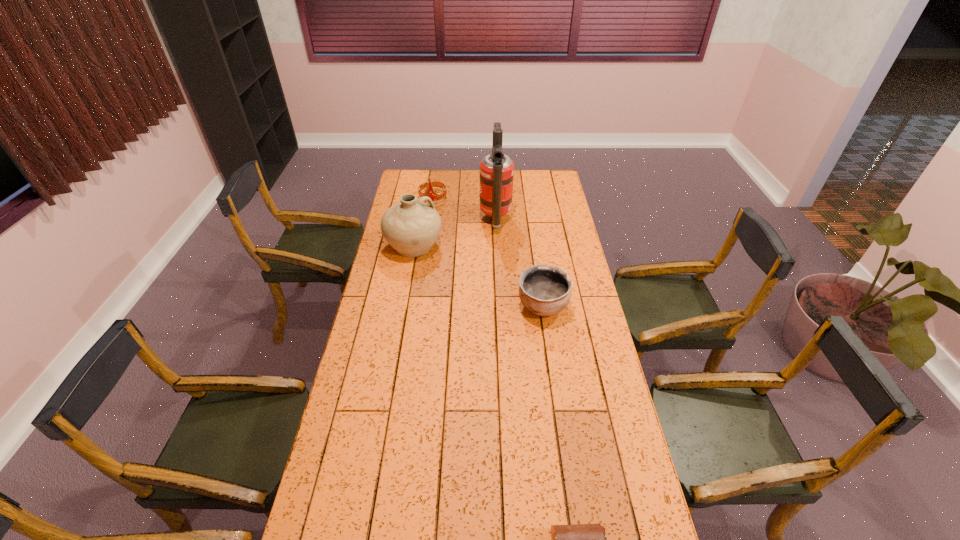
What are the coordinates of `free point located 0.130m on the front-facing side of the tiara` in the screenshot? It's located at (429, 222).

Where is `free location located on the left of the nearer pottery`? The image size is (960, 540). free location located on the left of the nearer pottery is located at coordinates (441, 307).

You are a GUI agent. You are given a task and a screenshot of the screen. Output one action in this format:
    pyautogui.click(x=<x>, y=<y>)
    Task: Click on the object located in the far edge section of the desktop
    The width and height of the screenshot is (960, 540).
    Given the screenshot: What is the action you would take?
    pyautogui.click(x=434, y=196)

The image size is (960, 540). What are the coordinates of `pottery that is at the left edge` in the screenshot? It's located at (411, 227).

Where is `tiara that is positioned at the left edge`? tiara that is positioned at the left edge is located at coordinates (434, 196).

Find the location of a particular element. The width and height of the screenshot is (960, 540). object present at the right edge is located at coordinates (545, 290).

I want to click on object that is at the far left corner, so click(434, 196).

In the image, there is a desktop. At what (x,y) coordinates should I click in order to perform the action: click on vacant space at the far edge. Please return your answer as a coordinate pair (x, y). Looking at the image, I should click on (479, 184).

You are a GUI agent. You are given a task and a screenshot of the screen. Output one action in this format:
    pyautogui.click(x=<x>, y=<y>)
    Task: Click on the free space at the left edge
    The image size is (960, 540).
    Given the screenshot: What is the action you would take?
    [400, 338]

The image size is (960, 540). What are the coordinates of `vacant space at the right edge` in the screenshot? It's located at (592, 483).